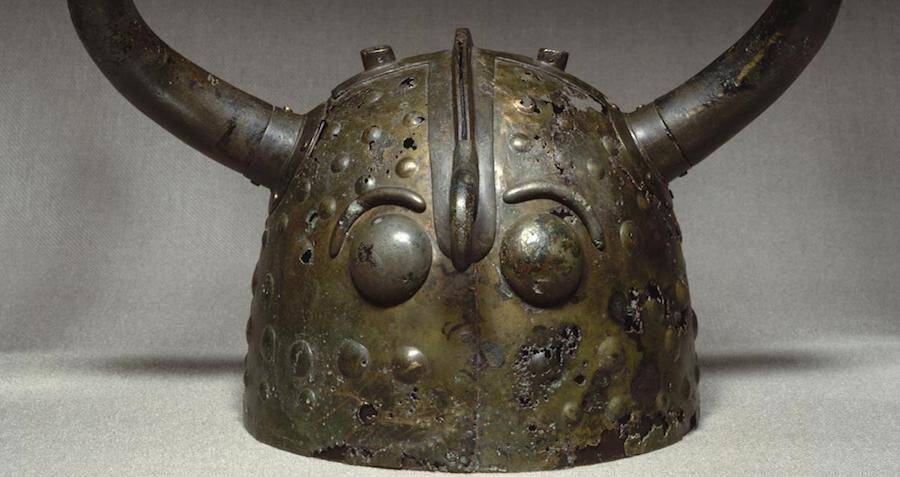
At what (x,y) coordinates should I click in order to perform the action: click on off-white fabric backdrop. Please return your answer as a coordinate pair (x, y). Looking at the image, I should click on (121, 217).